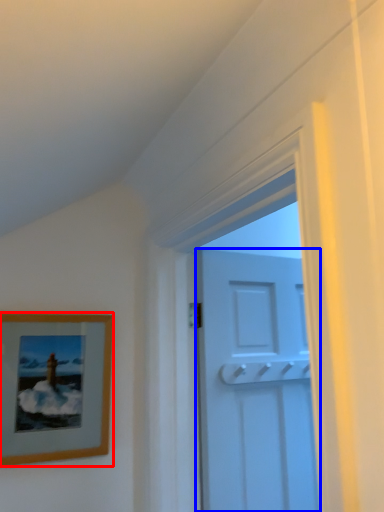
Question: Among these objects, which one is farthest to the camera, picture frame (highlighted by a red box) or door (highlighted by a blue box)?

Choices:
 (A) picture frame
 (B) door

Answer: (B)